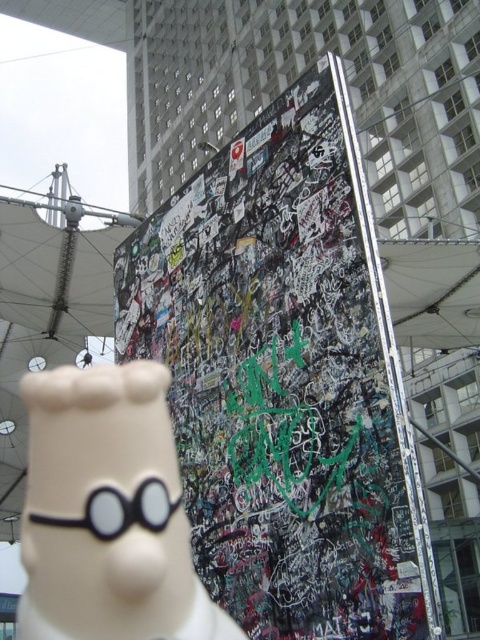
You are standing in front of the image and want to place a small sticker on the white matte figurine at center without covering the white fabric canopy at upper left. Is the figurine accessible for this task?

The white matte figurine at center is in front of the white fabric canopy at upper left, so yes, you can place the sticker on the white matte figurine at center without covering the canopy since it is positioned in front.